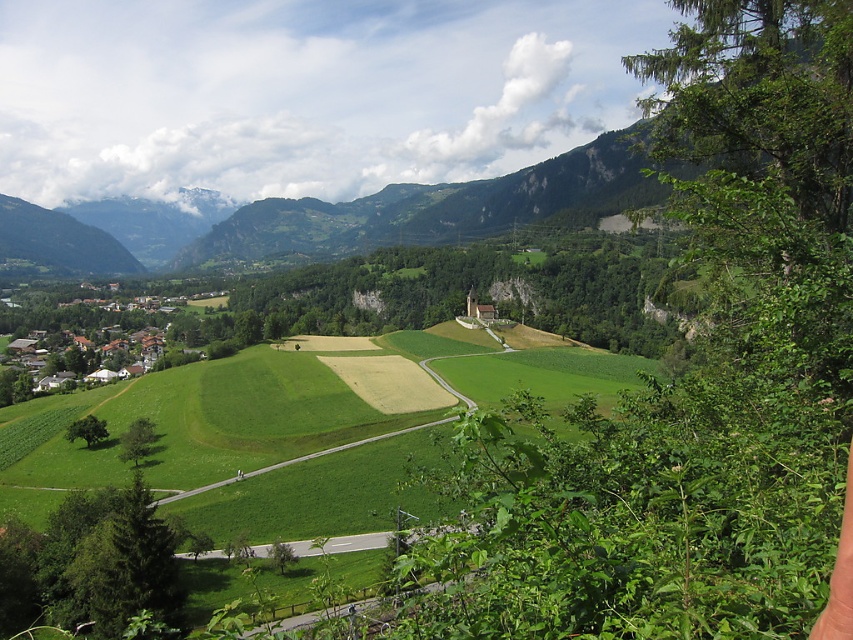
You are a drone operator trying to capture aerial footage of the green grass field at center. The coordinates provided are point [216,420]. To ensure the drone stays within the field, what coordinates should you input into the drone to maintain its position over the green grass field at center?

The green grass field at center is represented by point [216,420], so you should input the coordinates 0.659 and 0.254 to keep the drone positioned over the field.

You are a drone operator who needs to capture aerial footage of the green grass field at center and the white wooden houses at lower left. From the perspective of someone standing at the top of the hill, which object is located to the right side?

The green grass field at center is positioned on the right side of white wooden houses at lower left, so from the perspective of someone standing at the top of the hill, the green grass field at center is located to the right side.